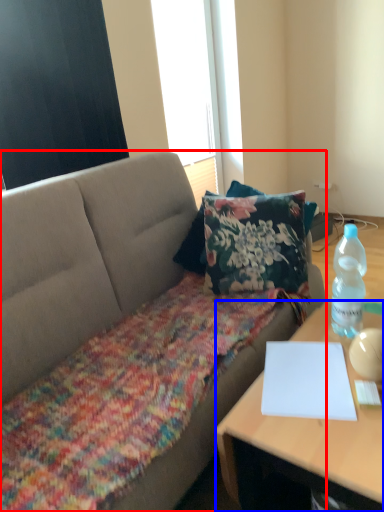
Question: Which of the following is the farthest to the observer, studio couch (highlighted by a red box) or desk (highlighted by a blue box)?

Choices:
 (A) studio couch
 (B) desk

Answer: (B)